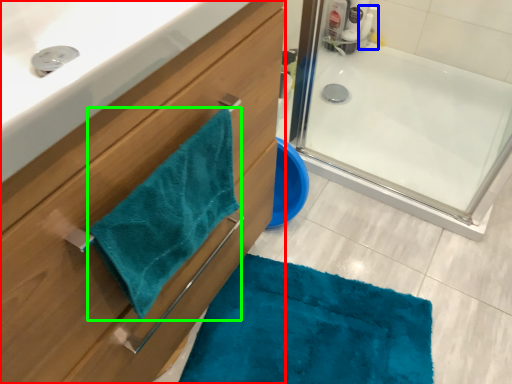
Question: Which object is positioned farthest from bathroom cabinet (highlighted by a red box)? Select from cleaning product (highlighted by a blue box) and beach towel (highlighted by a green box).

Choices:
 (A) cleaning product
 (B) beach towel

Answer: (A)